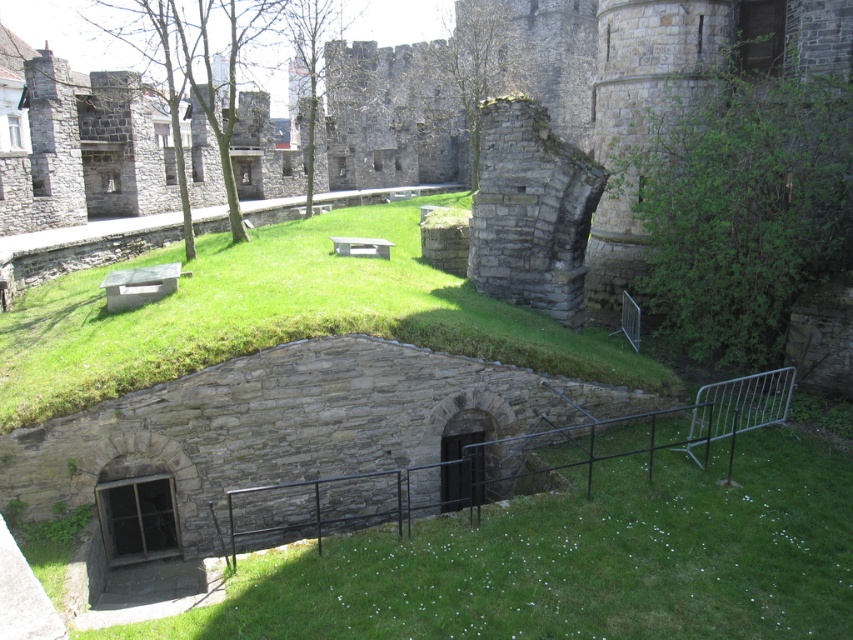
Between green grassy at lower center and green grassy at center, which one has more height?

With more height is green grassy at center.

Who is lower down, green grassy at lower center or green grassy at center?

green grassy at lower center is lower down.

The image size is (853, 640). I want to click on green grassy at lower center, so click(x=578, y=561).